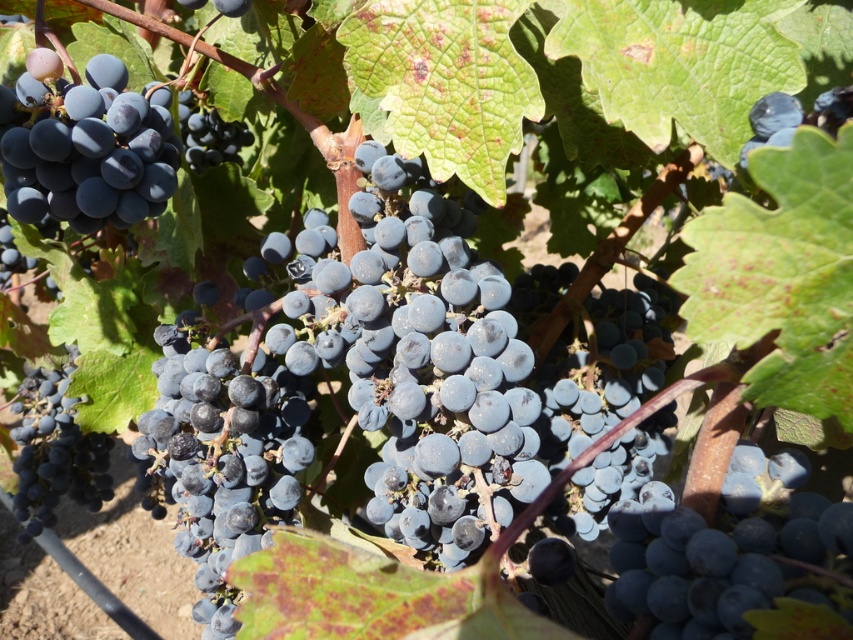
You are a farmer checking the grapevines and you notice two clusters of grapes. One is the shiny dark blue grapes at center and the other is the shiny dark blue grape at lower left. Which cluster takes up more space in the image?

The shiny dark blue grape at lower left takes up more space in the image than the shiny dark blue grapes at center.

You are a farmer inspecting grapes and need to determine which grape is bigger. You see a shiny dark blue grape at lower left and a shiny dark blue grape at upper left. Which one has a larger width?

The shiny dark blue grape at lower left has a larger width than the shiny dark blue grape at upper left.

You are a fruit inspector checking the grapes. You notice two shiny dark blue grapes in the image. Which one is nearer to you, the shiny dark blue grapes at center or the shiny dark blue grape at lower left?

The shiny dark blue grapes at center is closer to the viewer than the shiny dark blue grape at lower left.